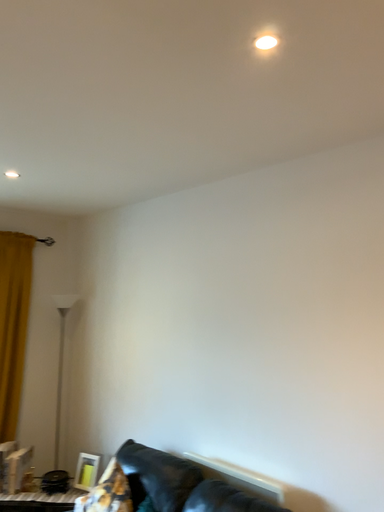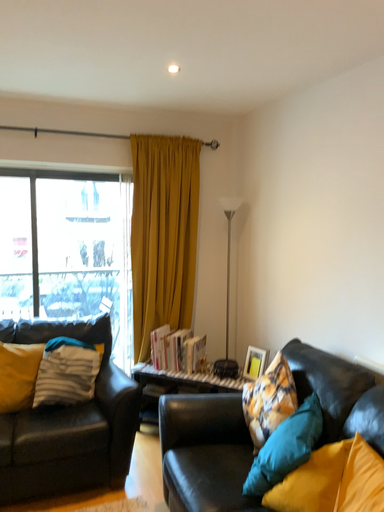
Question: Which way did the camera rotate in the video?

Choices:
 (A) rotated right
 (B) rotated left

Answer: (B)